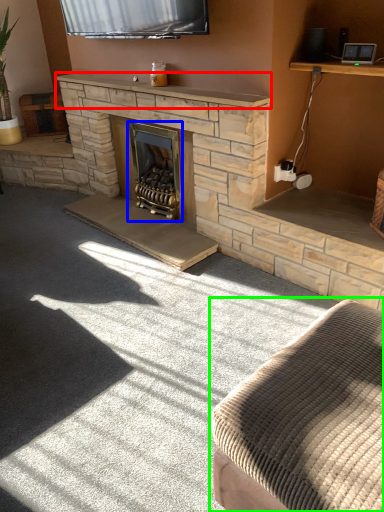
Question: Based on their relative distances, which object is farther from mantle (highlighted by a red box)? Choose from wood burning stove (highlighted by a blue box) and studio couch (highlighted by a green box).

Choices:
 (A) wood burning stove
 (B) studio couch

Answer: (B)